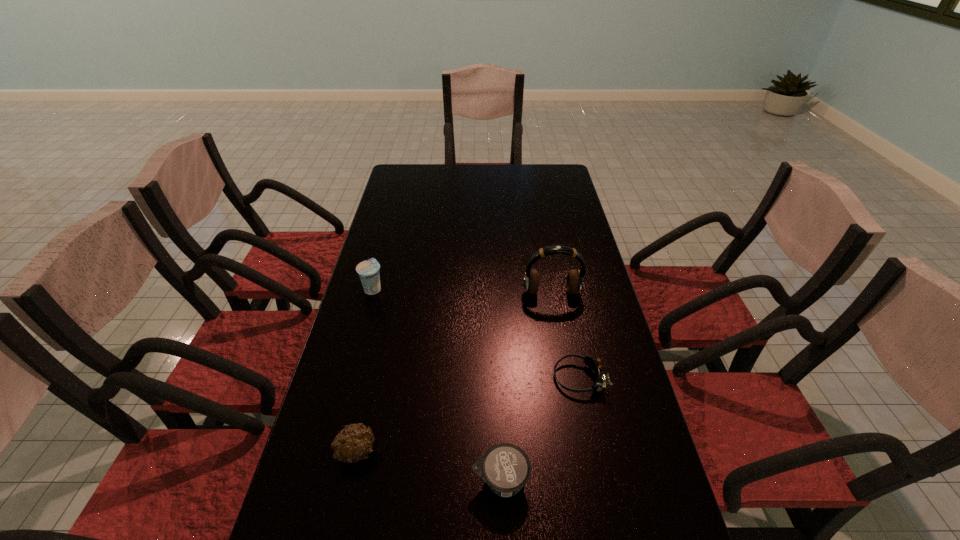
Find the location of `vacant space situated on the right of the muffin`. vacant space situated on the right of the muffin is located at coordinates (410, 451).

I want to click on free space located 0.170m on the left of the third object from right to left, so click(391, 480).

This screenshot has height=540, width=960. I want to click on vacant space situated 0.300m through the lenses of the shortest object, so click(x=434, y=377).

What are the coordinates of `free space located through the lenses of the shortest object` in the screenshot? It's located at (514, 377).

Locate an element on the screen. This screenshot has width=960, height=540. free region located through the lenses of the shortest object is located at coordinates (434, 377).

What are the coordinates of `yogurt present at the left edge` in the screenshot? It's located at (368, 270).

Where is `muffin located at the left edge`? muffin located at the left edge is located at coordinates (352, 444).

The image size is (960, 540). I want to click on headset situated at the right edge, so click(x=574, y=282).

Locate an element on the screen. This screenshot has width=960, height=540. goggles that is positioned at the right edge is located at coordinates (595, 364).

At what (x,y) coordinates should I click in order to perform the action: click on vacant space at the far edge of the desktop. Please return your answer as a coordinate pair (x, y). The height and width of the screenshot is (540, 960). Looking at the image, I should click on (470, 184).